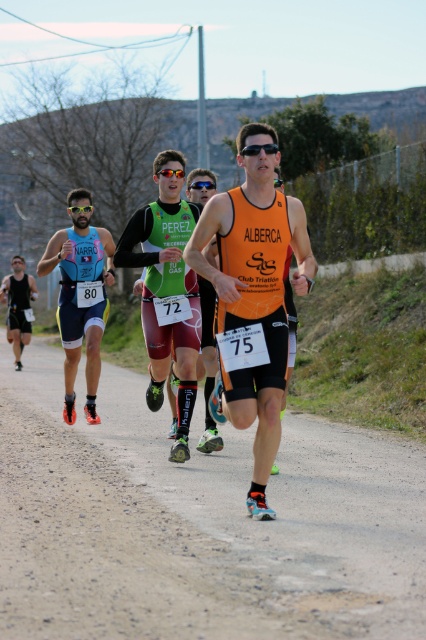
You are a photographer positioned at the starting line of the race. You want to capture a photo that includes both the matte black shorts at left and the blue reflective sunglasses at center. Given that your camera has a maximum focus range of 30 feet, will you be able to include both objects in the same frame without moving your position?

The matte black shorts at left is 34.40 feet away from the blue reflective sunglasses at center. Since the distance between them exceeds the camera maximum focus range of 30 feet, you cannot capture both objects in the same frame without moving your position.

You are a spectator at the event and want to find the runner wearing both the matte black shorts at left and black plastic goggles at center. Based on their positions, can you determine if the shorts are above or below the goggles?

The matte black shorts at left is located below the black plastic goggles at center, so the shorts are below the goggles.

You are a photographer positioned at the starting line of the race. You want to capture both the leading runner in orange and the runner with bib number 72. The leading runner is at point (6, 276) and the runner with bib 72 is at point (181, 177). Which runner will appear closer to the camera in your photo?

The leading runner at point (6, 276) will appear closer to the camera because the point is further to the camera than point (181, 177).